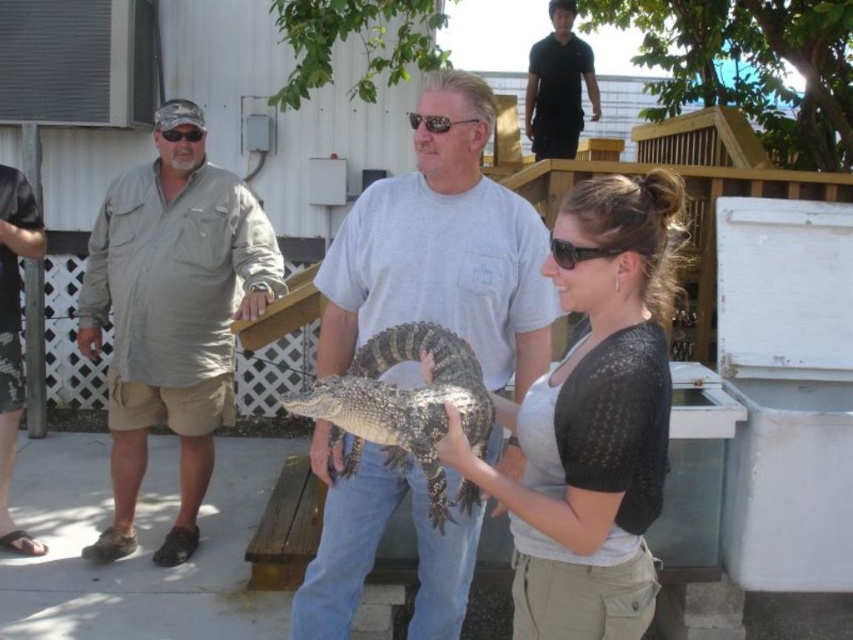
Question: Which point is closer to the camera?

Choices:
 (A) slate textured alligator at center
 (B) matte black sweater at center

Answer: (B)

Question: Considering the relative positions of slate textured alligator at center and black smooth shirt at upper center in the image provided, where is slate textured alligator at center located with respect to black smooth shirt at upper center?

Choices:
 (A) below
 (B) above

Answer: (A)

Question: Which object is the closest to the khaki cotton shirt at left?

Choices:
 (A) slate textured alligator at center
 (B) matte gray shirt at center
 (C) matte black sweater at center
 (D) brushed metal shirt at left

Answer: (D)

Question: Which of the following is the closest to the observer?

Choices:
 (A) pos(561,500)
 (B) pos(178,468)

Answer: (A)

Question: Can you confirm if matte gray shirt at center is smaller than khaki cotton shirt at left?

Choices:
 (A) yes
 (B) no

Answer: (A)

Question: Is slate textured alligator at center below brushed metal shirt at left?

Choices:
 (A) no
 (B) yes

Answer: (B)